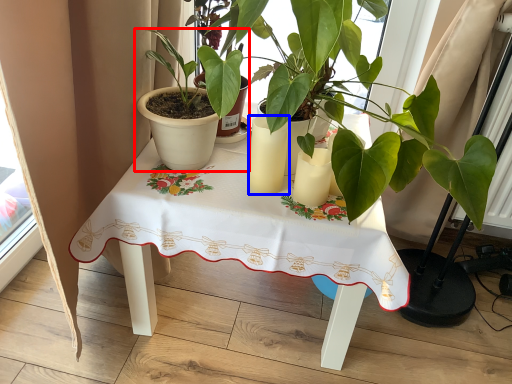
Question: Which object is further to the camera taking this photo, houseplant (highlighted by a red box) or candle holder (highlighted by a blue box)?

Choices:
 (A) houseplant
 (B) candle holder

Answer: (B)